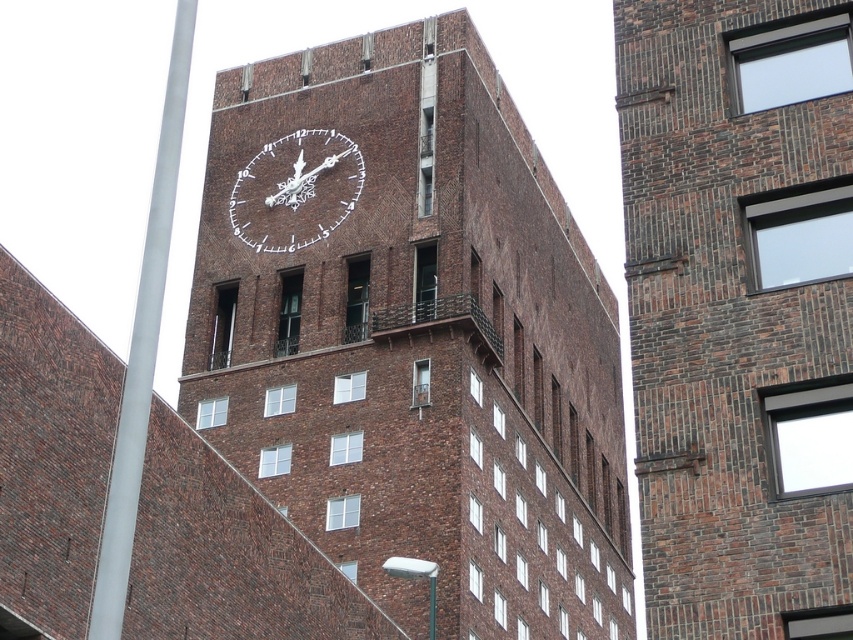
Is brown brick clock tower at center positioned before brown brick building at upper center?

No.

Between point (496, 136) and point (666, 496), which one is positioned in front?

Point (666, 496) is in front.

This screenshot has height=640, width=853. Identify the location of brown brick clock tower at center. (412, 336).

Where is `brown brick clock tower at center`? The width and height of the screenshot is (853, 640). brown brick clock tower at center is located at coordinates (412, 336).

Is smooth metallic pole at left above metallic silver clock at center?

Incorrect, smooth metallic pole at left is not positioned above metallic silver clock at center.

Between smooth metallic pole at left and metallic silver clock at center, which one is positioned lower?

smooth metallic pole at left is lower down.

Does point (141, 300) come farther from viewer compared to point (248, 241)?

No, (141, 300) is closer to viewer.

The width and height of the screenshot is (853, 640). In order to click on smooth metallic pole at left in this screenshot , I will do `click(142, 348)`.

Which of these two, brown brick clock tower at center or metallic silver clock at center, stands shorter?

metallic silver clock at center is shorter.

Can you confirm if brown brick clock tower at center is wider than metallic silver clock at center?

Yes, brown brick clock tower at center is wider than metallic silver clock at center.

This screenshot has height=640, width=853. Identify the location of brown brick clock tower at center. click(412, 336).